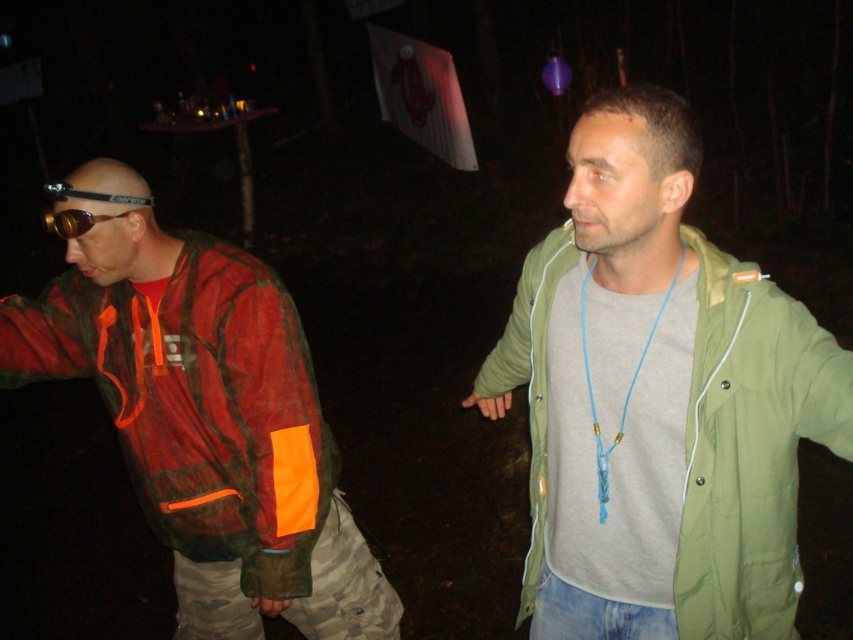
Does green fabric jacket at center appear over blue string necklace at center?

Actually, green fabric jacket at center is below blue string necklace at center.

Who is shorter, green fabric jacket at center or blue string necklace at center?

blue string necklace at center is shorter.

Does point (543, 412) come farther from viewer compared to point (619, 417)?

That is True.

Where is `green fabric jacket at center`? Image resolution: width=853 pixels, height=640 pixels. green fabric jacket at center is located at coordinates (659, 401).

From the picture: Between orange mesh jacket at left and blue string necklace at center, which one is positioned lower?

orange mesh jacket at left is lower down.

Does orange mesh jacket at left have a lesser height compared to blue string necklace at center?

No.

Does point (196, 460) come in front of point (604, 452)?

No, (196, 460) is behind (604, 452).

The image size is (853, 640). I want to click on orange mesh jacket at left, so click(x=204, y=416).

Can you confirm if green fabric jacket at center is smaller than orange mesh jacket at left?

Yes.

Can you confirm if green fabric jacket at center is thinner than orange mesh jacket at left?

Correct, green fabric jacket at center's width is less than orange mesh jacket at left's.

Is point (780, 609) less distant than point (265, 500)?

Yes, point (780, 609) is closer to viewer.

In order to click on green fabric jacket at center in this screenshot , I will do `click(659, 401)`.